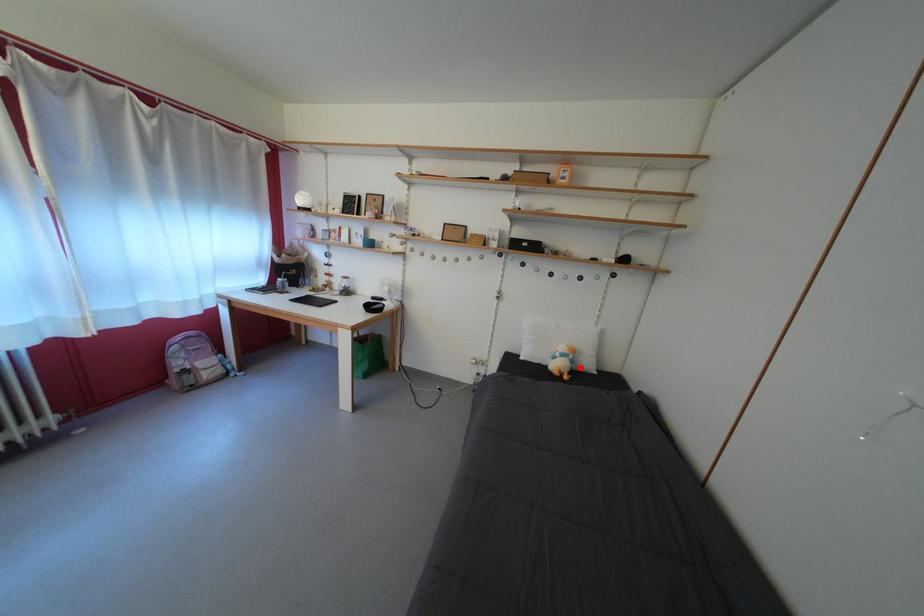
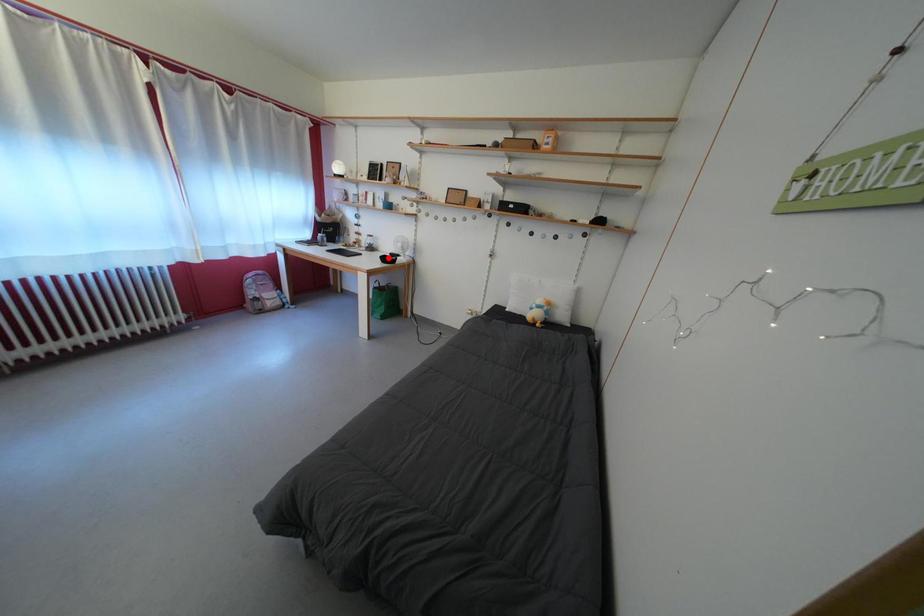
I am providing you with two images of the same scene from different viewpoints. A red point is marked on the first image and another point is marked on the second image. Do the highlighted points in image1 and image2 indicate the same real-world spot?

No